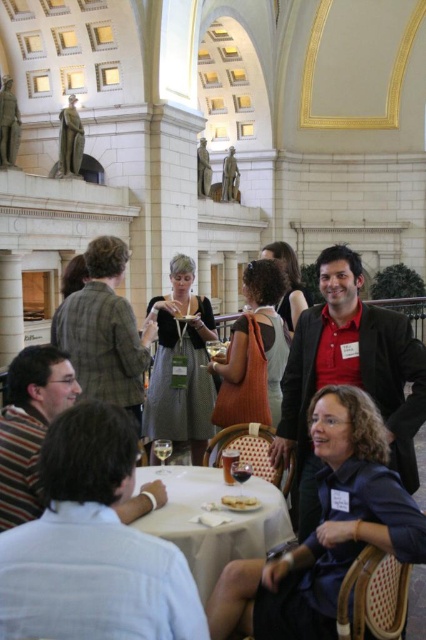
In the scene shown: You are at a social event and want to greet both the person wearing the light blue shirt at lower left and the person in the matte red shirt at center. Which individual should you approach first if you want to start with the one closer to the left side of the table?

The light blue shirt at lower left is positioned on the left side of the matte red shirt at center, so you should approach the light blue shirt at lower left first as they are closer to the left side of the table.

You are standing at the entrance of the grand hall and notice a point marked at coordinates (181,364). What object is located precisely at that point?

The object located precisely at the point (181,364) is the matte black dress at center.

You are a photographer at the event and want to take a photo of the transparent glass wine at table center without the matte black dress at center blocking it. Is this possible?

The matte black dress at center is positioned over the transparent glass wine at table center, so it will block the view. Move the dress or adjust the camera angle to capture the glass wine without obstruction.